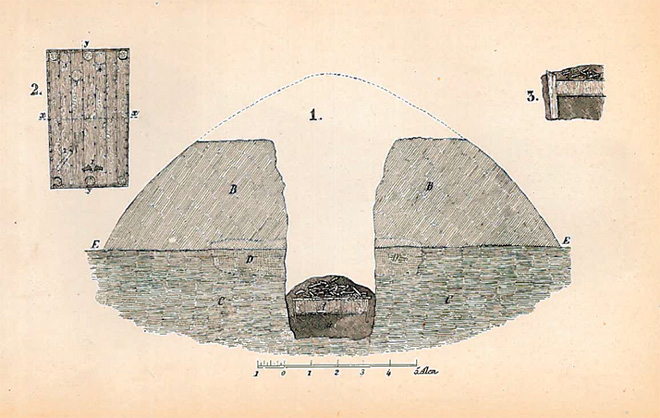
Where is `door`? door is located at coordinates (88, 114).